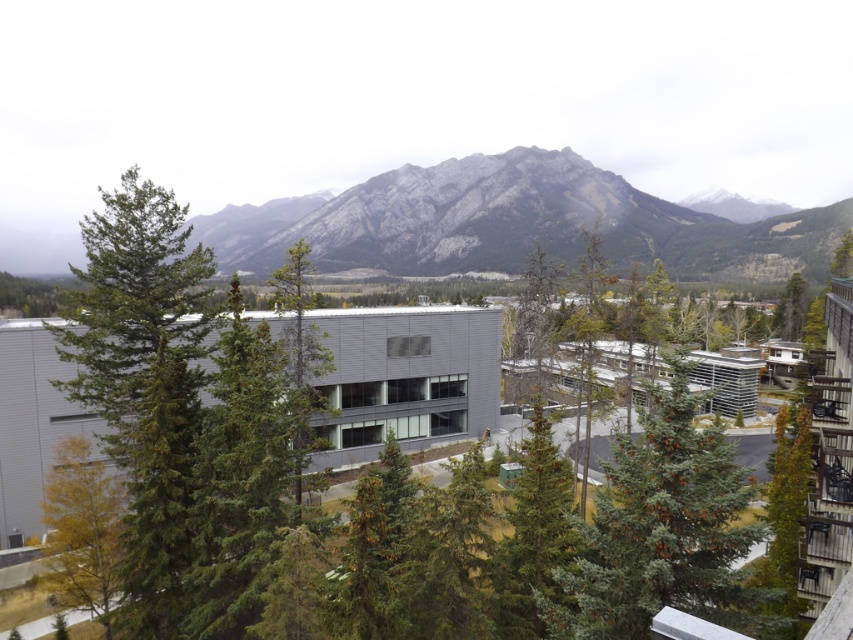
Question: Considering the real-world distances, which object is farthest from the green coniferous tree at center?

Choices:
 (A) yellow-green foliage at lower left
 (B) green matte tree at upper right
 (C) green matte tree at center
 (D) gray rock mountain at upper center

Answer: (D)

Question: Can you confirm if gray rock mountain at upper center is smaller than green coniferous tree at center?

Choices:
 (A) no
 (B) yes

Answer: (A)

Question: Observing the image, what is the correct spatial positioning of yellow-green foliage at lower left in reference to green matte tree at center?

Choices:
 (A) left
 (B) right

Answer: (A)

Question: Estimate the real-world distances between objects in this image. Which object is closer to the green matte tree at center?

Choices:
 (A) gray rock mountain at upper center
 (B) green coniferous tree at center
 (C) green matte tree at upper right
 (D) yellow-green foliage at lower left

Answer: (D)

Question: Can you confirm if gray rock mountain at upper center is smaller than green matte tree at center?

Choices:
 (A) no
 (B) yes

Answer: (A)

Question: Considering the real-world distances, which object is farthest from the green matte tree at center?

Choices:
 (A) yellow-green foliage at lower left
 (B) gray rock mountain at upper center
 (C) green coniferous tree at center

Answer: (B)